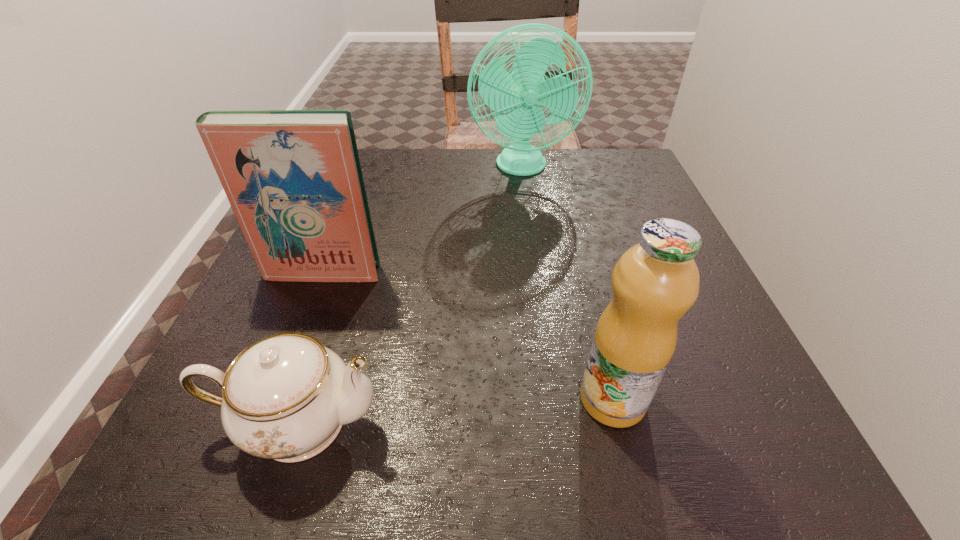
You are a GUI agent. You are given a task and a screenshot of the screen. Output one action in this format:
    pyautogui.click(x=<x>, y=<y>)
    Task: Click on the blank region between the fruit juice and the chinaware
    The image size is (960, 540).
    Given the screenshot: What is the action you would take?
    [x=455, y=411]

The image size is (960, 540). Find the location of `blank region between the hardback book and the fan`. blank region between the hardback book and the fan is located at coordinates (421, 220).

The image size is (960, 540). In order to click on blank region between the chinaware and the fruit juice in this screenshot , I will do coord(455,411).

The height and width of the screenshot is (540, 960). I want to click on free space between the second farthest object and the fan, so click(421, 220).

I want to click on unoccupied position between the fruit juice and the third nearest object, so click(468, 335).

The image size is (960, 540). I want to click on blank region between the chinaware and the fruit juice, so click(455, 411).

Identify which object is the third nearest to the hardback book. Please provide its 2D coordinates. Your answer should be formatted as a tuple, i.e. [(x, y)], where the tuple contains the x and y coordinates of a point satisfying the conditions above.

[(655, 282)]

Image resolution: width=960 pixels, height=540 pixels. Find the location of `object that can be found as the third closest to the chinaware`. object that can be found as the third closest to the chinaware is located at coordinates (518, 92).

The height and width of the screenshot is (540, 960). Find the location of `vacant space that satisfies the following two spatial constraints: 1. in front of the fan to blow air; 2. at the spout of the chinaware`. vacant space that satisfies the following two spatial constraints: 1. in front of the fan to blow air; 2. at the spout of the chinaware is located at coordinates coord(558,422).

At what (x,y) coordinates should I click in order to perform the action: click on blank space that satisfies the following two spatial constraints: 1. on the front label of the fruit juice; 2. at the spout of the shortest object. Please return your answer as a coordinate pair (x, y). The height and width of the screenshot is (540, 960). Looking at the image, I should click on (618, 422).